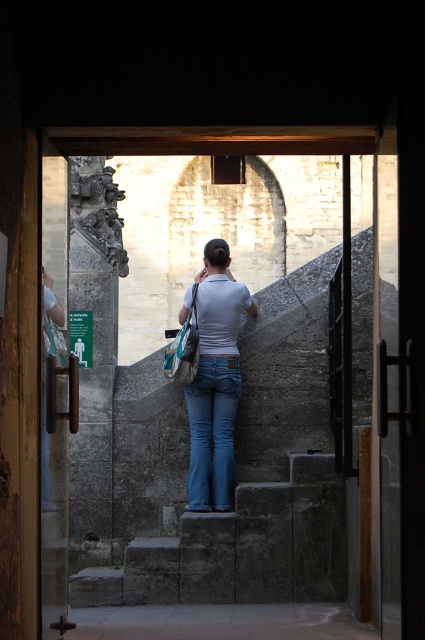
Question: Can you confirm if blue denim jeans at center is thinner than teal fabric bag at center?

Choices:
 (A) yes
 (B) no

Answer: (A)

Question: Among these points, which one is farthest from the camera?

Choices:
 (A) (170, 376)
 (B) (193, 458)
 (C) (192, 452)
 (D) (322, 570)

Answer: (C)

Question: Is denim jeans at center bigger than teal fabric bag at center?

Choices:
 (A) no
 (B) yes

Answer: (B)

Question: Is denim jeans at center wider than blue denim jeans at center?

Choices:
 (A) yes
 (B) no

Answer: (A)

Question: Which of the following is the farthest from the observer?

Choices:
 (A) teal fabric bag at center
 (B) blue denim jeans at center

Answer: (B)

Question: Which point is farther to the camera?

Choices:
 (A) (152, 566)
 (B) (172, 344)
 (C) (206, 444)
 (D) (206, 404)

Answer: (B)